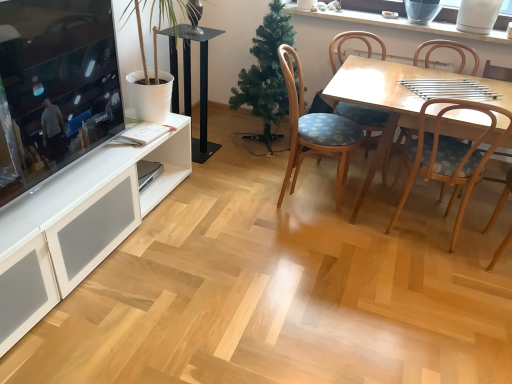
Question: Is wooden chair with floral cushion at center, the fourth chair positioned from the left, smaller than green matte christmas tree at center?

Choices:
 (A) no
 (B) yes

Answer: (B)

Question: Is wooden chair with floral cushion at center, the fourth chair positioned from the left, positioned behind green matte christmas tree at center?

Choices:
 (A) no
 (B) yes

Answer: (A)

Question: Does wooden chair with floral cushion at center, the 1th chair when ordered from right to left, lie in front of green matte christmas tree at center?

Choices:
 (A) no
 (B) yes

Answer: (B)

Question: Considering the relative sizes of wooden chair with floral cushion at center, the 1th chair when ordered from right to left, and green matte christmas tree at center in the image provided, is wooden chair with floral cushion at center, the 1th chair when ordered from right to left, shorter than green matte christmas tree at center?

Choices:
 (A) yes
 (B) no

Answer: (A)

Question: Could you tell me if wooden chair with floral cushion at center, the 1th chair when ordered from right to left, is facing green matte christmas tree at center?

Choices:
 (A) no
 (B) yes

Answer: (A)

Question: Is wooden chair with floral cushion at center, the 1th chair when ordered from right to left, not inside green matte christmas tree at center?

Choices:
 (A) yes
 (B) no

Answer: (A)

Question: Considering the relative sizes of wooden chair with floral cushion at center, the 1th chair when ordered from right to left, and matte black television at left in the image provided, is wooden chair with floral cushion at center, the 1th chair when ordered from right to left, thinner than matte black television at left?

Choices:
 (A) yes
 (B) no

Answer: (B)

Question: From a real-world perspective, is wooden chair with floral cushion at center, the 1th chair when ordered from right to left, positioned over matte black television at left based on gravity?

Choices:
 (A) no
 (B) yes

Answer: (A)

Question: Considering the relative sizes of wooden chair with floral cushion at center, the fourth chair positioned from the left, and matte black television at left in the image provided, is wooden chair with floral cushion at center, the fourth chair positioned from the left, taller than matte black television at left?

Choices:
 (A) yes
 (B) no

Answer: (A)

Question: Is wooden chair with floral cushion at center, the 1th chair when ordered from right to left, wider than matte black television at left?

Choices:
 (A) yes
 (B) no

Answer: (A)

Question: Could matte black television at left be considered to be inside wooden chair with floral cushion at center, the fourth chair positioned from the left?

Choices:
 (A) yes
 (B) no

Answer: (B)

Question: Could you tell me if wooden chair with floral cushion at center, the fourth chair positioned from the left, is facing matte black television at left?

Choices:
 (A) yes
 (B) no

Answer: (B)

Question: Does black glass speaker at center appear on the left side of wooden chair with blue cushion at center-right, which is the second chair from right to left?

Choices:
 (A) yes
 (B) no

Answer: (A)